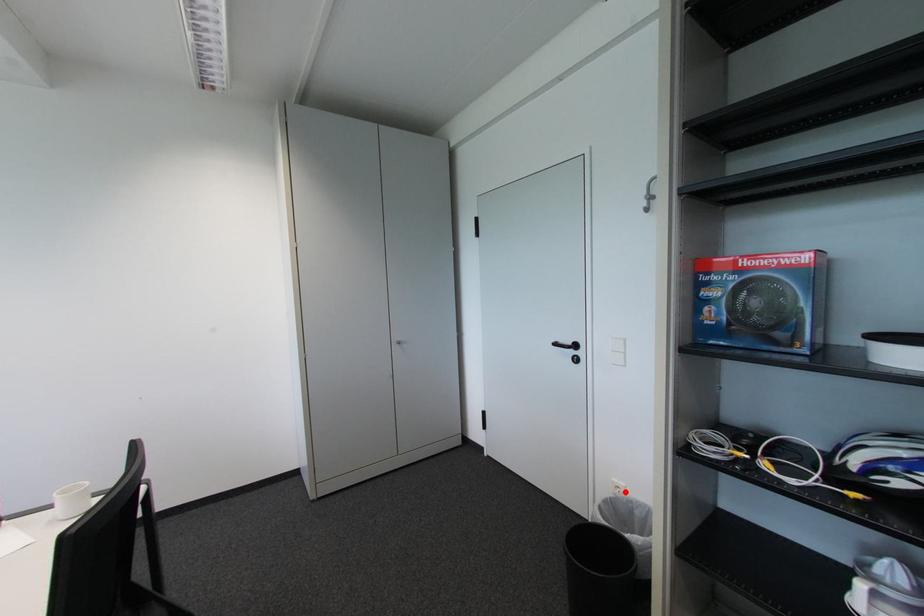
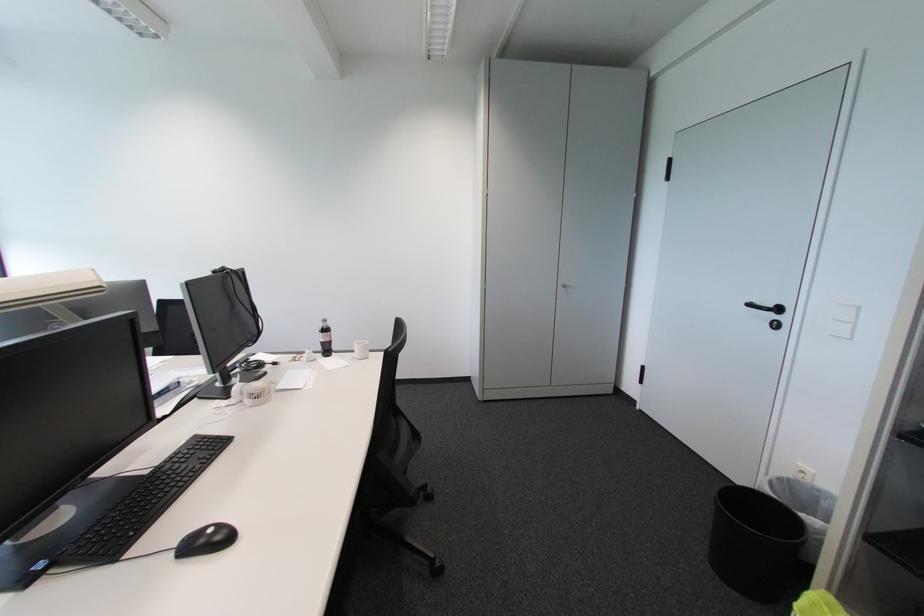
Question: I am providing you with two images of the same scene from different viewpoints. In image1, a red point is highlighted. Considering the same 3D point in image2, which of the following is correct?

Choices:
 (A) It is closer
 (B) It is farther

Answer: (B)